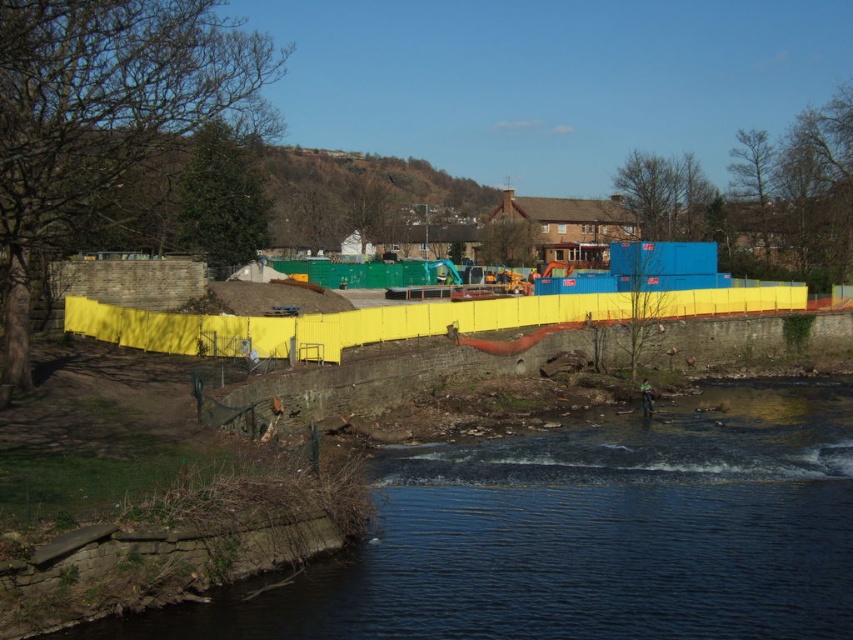
You are a safety inspector checking the construction site near the river. You notice the dark blue water at lower center and the yellow plastic barrier at center. Based on their positions, which object is closer to the riverbank?

The dark blue water at lower center is closer to the riverbank because it is positioned to the left of the yellow plastic barrier at center, and the riverbank is on the left side of the image.

You are a safety inspector evaluating the construction site. The dark blue water at lower center and the yellow plastic barrier at center are both present. Which object is taller?

The yellow plastic barrier at center is taller than the dark blue water at lower center.

You are a safety inspector checking the construction site near the river. You notice the dark blue water at lower center and the yellow plastic barrier at center. According to safety protocols, barriers must be placed above water to prevent contamination. Is the current placement compliant with the regulations?

The dark blue water at lower center is below the yellow plastic barrier at center, which means the barrier is positioned above the water. This placement complies with the safety protocols as it prevents contamination.